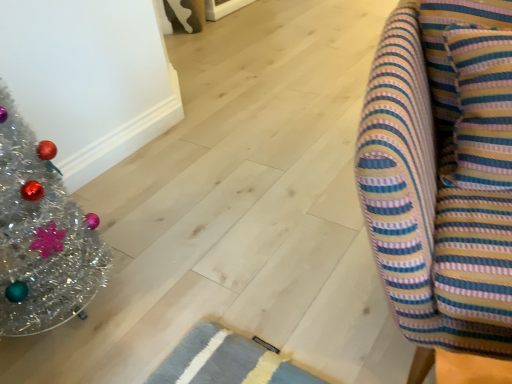
At what (x,y) coordinates should I click in order to perform the action: click on striped fabric couch at right. Please return your answer as a coordinate pair (x, y). Looking at the image, I should click on (442, 172).

The image size is (512, 384). What do you see at coordinates (442, 172) in the screenshot?
I see `striped fabric couch at right` at bounding box center [442, 172].

Image resolution: width=512 pixels, height=384 pixels. What do you see at coordinates (41, 235) in the screenshot?
I see `shiny silver christmas tree at left` at bounding box center [41, 235].

The width and height of the screenshot is (512, 384). I want to click on shiny silver christmas tree at left, so click(41, 235).

Where is `striped fabric couch at right`? striped fabric couch at right is located at coordinates (442, 172).

Does striped fabric couch at right appear on the right side of shiny silver christmas tree at left?

Indeed, striped fabric couch at right is positioned on the right side of shiny silver christmas tree at left.

Which object is closer to the camera, striped fabric couch at right or shiny silver christmas tree at left?

striped fabric couch at right.

Considering the points (434, 117) and (28, 135), which point is in front, point (434, 117) or point (28, 135)?

Point (434, 117)

From the image's perspective, is striped fabric couch at right located beneath shiny silver christmas tree at left?

Actually, striped fabric couch at right appears above shiny silver christmas tree at left in the image.

From a real-world perspective, is striped fabric couch at right beneath shiny silver christmas tree at left?

Yes, from a real-world perspective, striped fabric couch at right is under shiny silver christmas tree at left.

Looking at this image, between striped fabric couch at right and shiny silver christmas tree at left, which one has larger width?

Wider between the two is striped fabric couch at right.

Considering the sizes of striped fabric couch at right and shiny silver christmas tree at left in the image, is striped fabric couch at right taller or shorter than shiny silver christmas tree at left?

In the image, striped fabric couch at right appears to be shorter than shiny silver christmas tree at left.

Does striped fabric couch at right have a larger size compared to shiny silver christmas tree at left?

Yes.

From the picture: Does striped fabric couch at right contain shiny silver christmas tree at left?

No.

Is striped fabric couch at right far from shiny silver christmas tree at left?

No, striped fabric couch at right is in close proximity to shiny silver christmas tree at left.

Is striped fabric couch at right positioned with its back to shiny silver christmas tree at left?

No, shiny silver christmas tree at left is not at the back of striped fabric couch at right.

Can you tell me how much striped fabric couch at right and shiny silver christmas tree at left differ in facing direction?

70.2 degrees separate the facing orientations of striped fabric couch at right and shiny silver christmas tree at left.

You are a GUI agent. You are given a task and a screenshot of the screen. Output one action in this format:
    pyautogui.click(x=<x>, y=<y>)
    Task: Click on the furniture above the shiny silver christmas tree at left (from the image's perspective)
    This screenshot has width=512, height=384.
    Given the screenshot: What is the action you would take?
    pyautogui.click(x=442, y=172)

Is shiny silver christmas tree at left at the right side of striped fabric couch at right?

Incorrect, shiny silver christmas tree at left is not on the right side of striped fabric couch at right.

Does shiny silver christmas tree at left come behind striped fabric couch at right?

Yes, it is.

Is point (63, 264) closer to camera compared to point (507, 222)?

That is False.

From the image's perspective, who appears lower, shiny silver christmas tree at left or striped fabric couch at right?

shiny silver christmas tree at left.

From a real-world perspective, is shiny silver christmas tree at left on striped fabric couch at right?

Yes, from a real-world perspective, shiny silver christmas tree at left is above striped fabric couch at right.

Can you confirm if shiny silver christmas tree at left is thinner than striped fabric couch at right?

Yes.

Which of these two, shiny silver christmas tree at left or striped fabric couch at right, stands taller?

With more height is shiny silver christmas tree at left.

Considering the sizes of shiny silver christmas tree at left and striped fabric couch at right in the image, is shiny silver christmas tree at left bigger or smaller than striped fabric couch at right?

In the image, shiny silver christmas tree at left appears to be smaller than striped fabric couch at right.

Is shiny silver christmas tree at left situated inside striped fabric couch at right or outside?

shiny silver christmas tree at left exists outside the volume of striped fabric couch at right.

Is shiny silver christmas tree at left beside striped fabric couch at right?

No.

Is striped fabric couch at right at the back of shiny silver christmas tree at left?

No, shiny silver christmas tree at left is not facing away from striped fabric couch at right.

What's the angular difference between shiny silver christmas tree at left and striped fabric couch at right's facing directions?

70.2 degrees separate the facing orientations of shiny silver christmas tree at left and striped fabric couch at right.

How far apart are shiny silver christmas tree at left and striped fabric couch at right?

The distance of shiny silver christmas tree at left from striped fabric couch at right is 34.95 inches.

The width and height of the screenshot is (512, 384). In the image, there is a striped fabric couch at right. What are the coordinates of `christmas tree below it (from the image's perspective)` in the screenshot? It's located at (41, 235).

At what (x,y) coordinates should I click in order to perform the action: click on christmas tree located below the striped fabric couch at right (from the image's perspective). Please return your answer as a coordinate pair (x, y). The image size is (512, 384). Looking at the image, I should click on click(x=41, y=235).

Image resolution: width=512 pixels, height=384 pixels. What are the coordinates of `christmas tree lying on the left of striped fabric couch at right` in the screenshot? It's located at (41, 235).